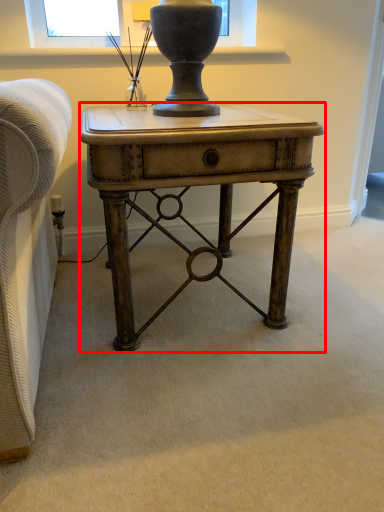
Question: From the image's perspective, what is the correct spatial positioning of desk (annotated by the red box) in reference to table lamp?

Choices:
 (A) above
 (B) below

Answer: (B)